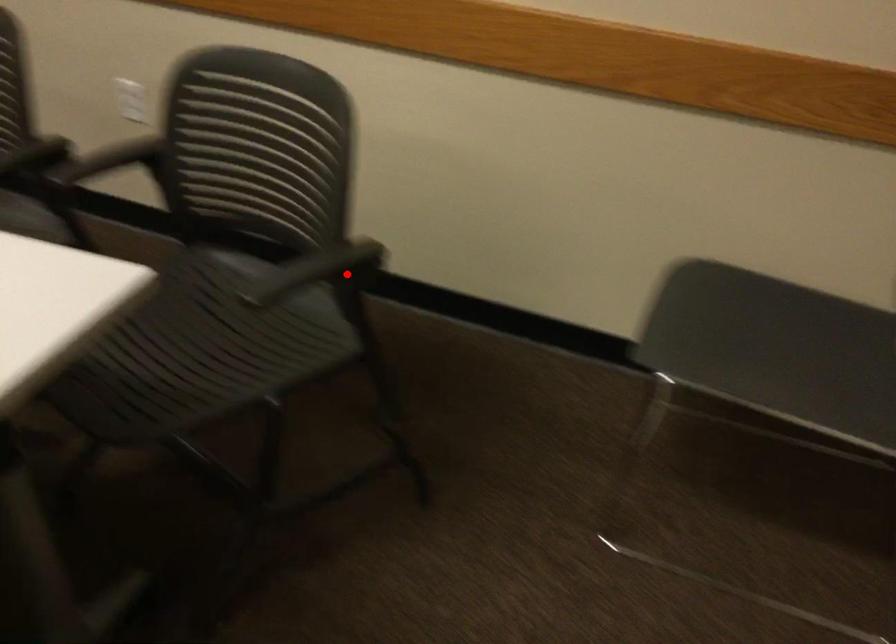
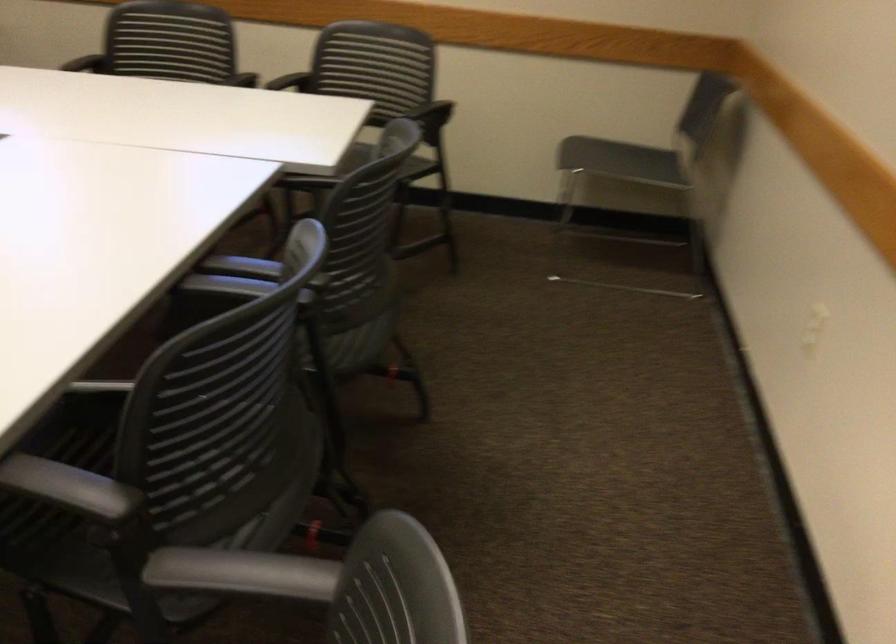
Question: I am providing you with two images of the same scene from different viewpoints. Given a red point in image1, look at the same physical point in image2. Is it:

Choices:
 (A) Closer to the viewpoint
 (B) Farther from the viewpoint

Answer: (B)